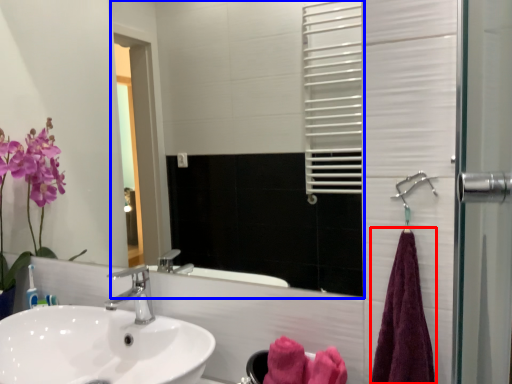
Question: Which object is further to the camera taking this photo, bath towel (highlighted by a red box) or mirror (highlighted by a blue box)?

Choices:
 (A) bath towel
 (B) mirror

Answer: (B)